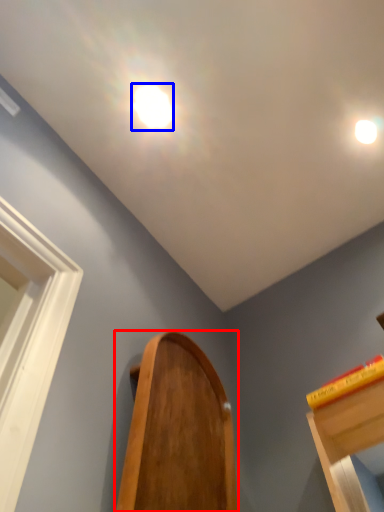
Question: Which object appears closest to the camera in this image, furniture (highlighted by a red box) or droplight (highlighted by a blue box)?

Choices:
 (A) furniture
 (B) droplight

Answer: (A)